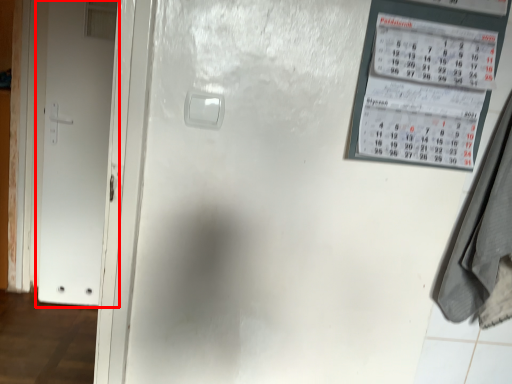
Question: From the image's perspective, what is the correct spatial relationship of door (annotated by the red box) in relation to laundry?

Choices:
 (A) below
 (B) above

Answer: (B)